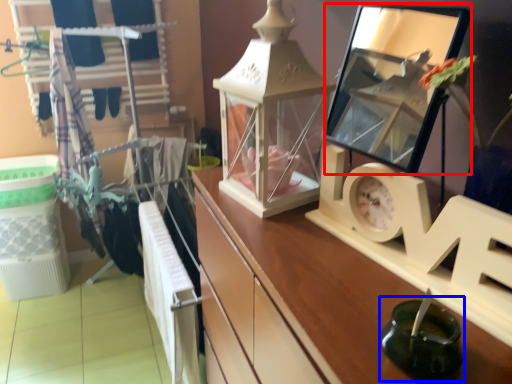
Question: Which of the following is the farthest to the observer, mirror (highlighted by a red box) or candle holder (highlighted by a blue box)?

Choices:
 (A) mirror
 (B) candle holder

Answer: (A)